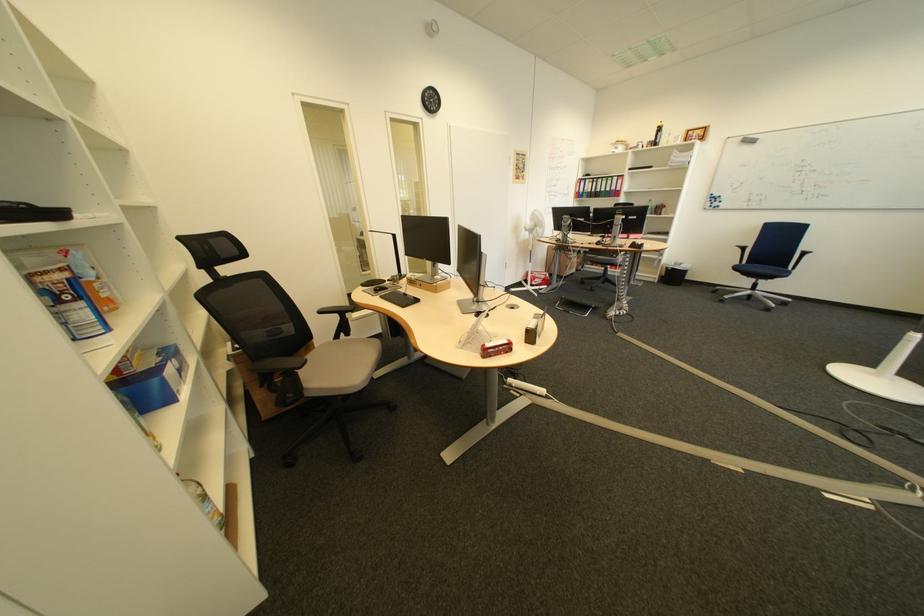
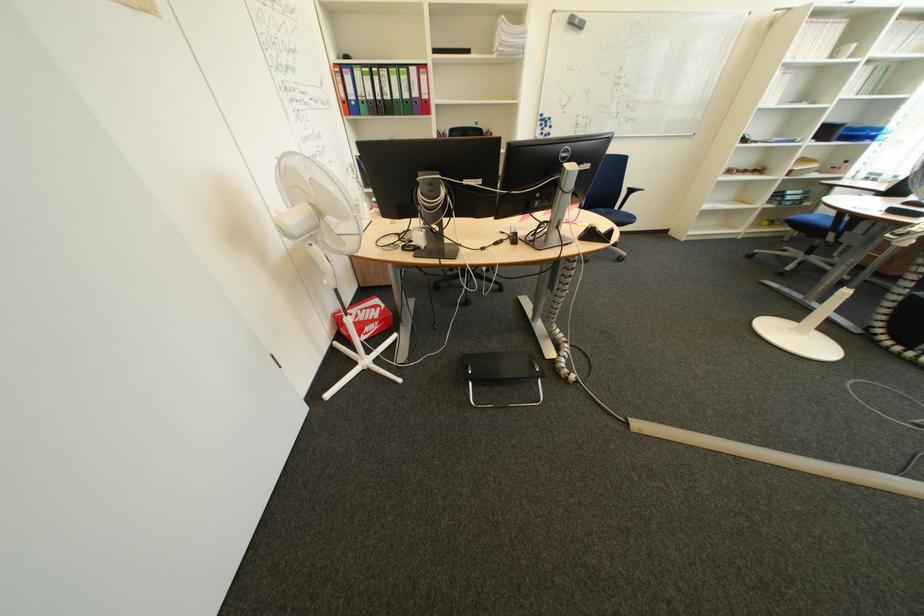
Find the pixel in the second image that matches the point at 648,219 in the first image.

(601, 168)